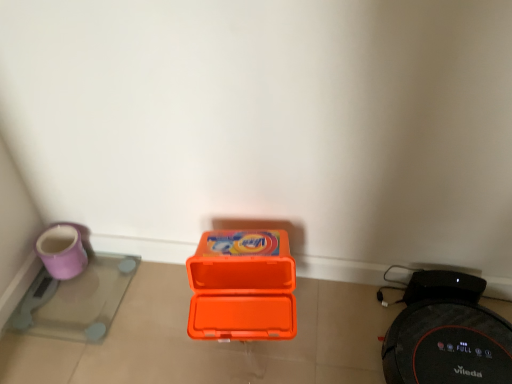
I want to click on vacant region to the right of purple glossy scale at lower left, the second appliance when ordered from right to left, so click(x=152, y=314).